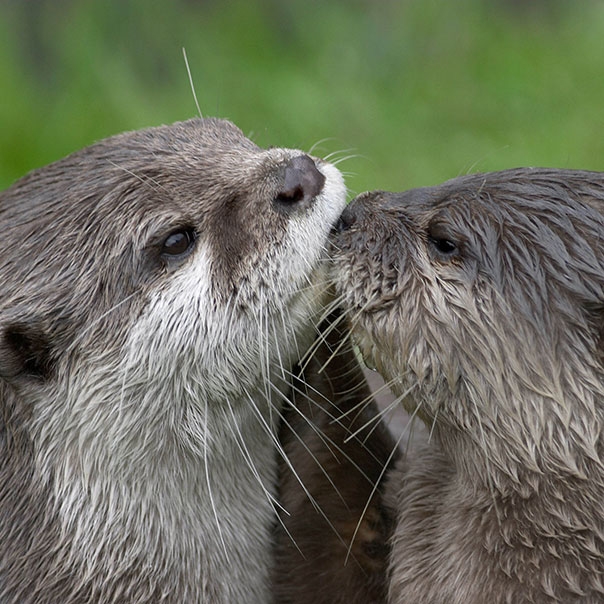
The height and width of the screenshot is (604, 604). I want to click on white fur, so click(x=174, y=335), click(x=104, y=464), click(x=170, y=478), click(x=307, y=223), click(x=336, y=188).